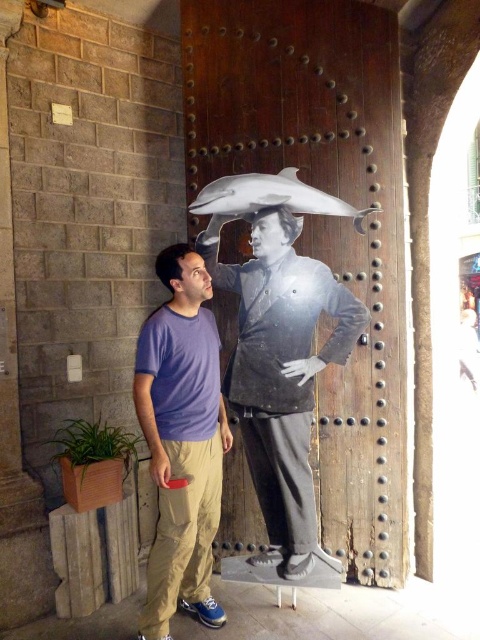
Question: Does wooden at upper center have a smaller size compared to purple cotton t-shirt at center?

Choices:
 (A) yes
 (B) no

Answer: (B)

Question: From the image, what is the correct spatial relationship of wooden at upper center in relation to purple cotton t-shirt at center?

Choices:
 (A) below
 (B) above

Answer: (B)

Question: Among these objects, which one is farthest from the camera?

Choices:
 (A) purple cotton t-shirt at center
 (B) wooden at upper center

Answer: (B)

Question: Is wooden at upper center positioned in front of purple cotton t-shirt at center?

Choices:
 (A) yes
 (B) no

Answer: (B)

Question: Which point is farther from the camera taking this photo?

Choices:
 (A) (301, 124)
 (B) (202, 468)

Answer: (A)